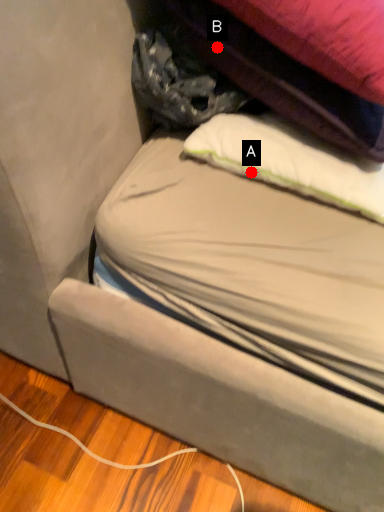
Question: Two points are circled on the image, labeled by A and B beside each circle. Which point appears closest to the camera in this image?

Choices:
 (A) A is closer
 (B) B is closer

Answer: (B)